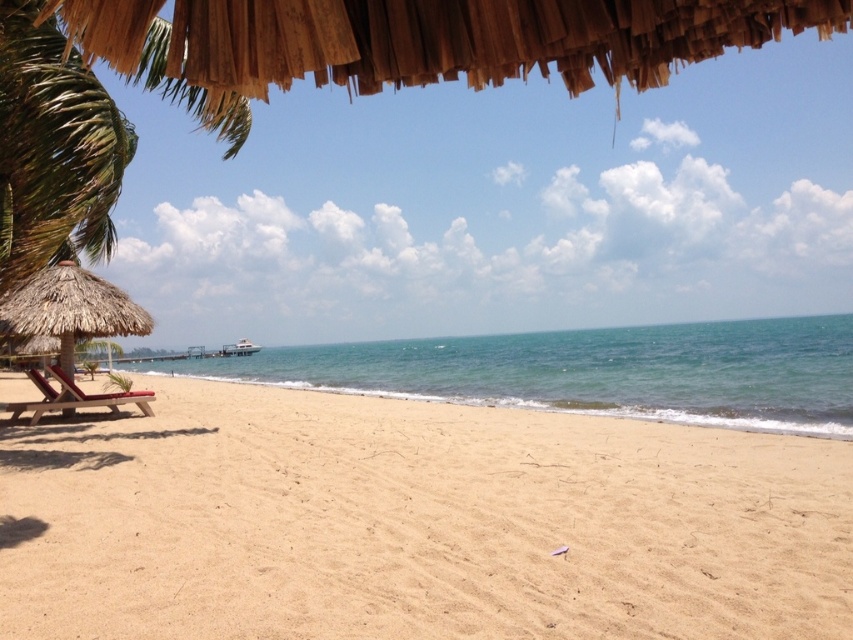
You are a beachgoer planning to set up a picnic. You have a large picnic blanket that requires a wide open space. Based on the scene, which area would be more suitable for placing the blanket between the light beige sand at center and the thatched straw umbrella at left?

The light beige sand at center is wider than the thatched straw umbrella at left, so it would be more suitable for placing the picnic blanket.

You are a beachgoer carrying a 5 meter long surfboard. You want to place it on the sand so that it doesn not block the path between the light beige sand at center and the thatched straw umbrella at left. Is this possible?

The light beige sand at center is 5.21 meters from the thatched straw umbrella at left. Since the surfboard is 5 meters long, placing it along the path would leave 0.21 meters of space between them. This narrow space might be too small for comfortable passage, so it is not advisable to place the surfboard there.

You are a beachgoer who wants to place a new beach bag between the thatched straw umbrella at left and the matte brown lounge chair at lower left. Based on their positions, which object should the bag be closer to if you want it to be nearer to the one on the left side of the image?

The matte brown lounge chair at lower left is on the left side of the thatched straw umbrella at left. Since the bag needs to be near the leftmost object, it should be placed closer to the matte brown lounge chair at lower left.